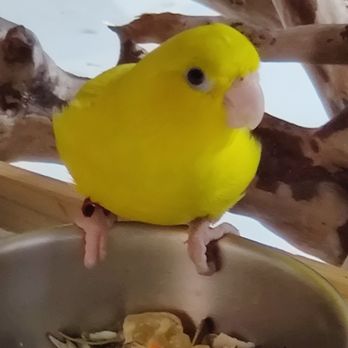
Where is `bowl`? bowl is located at coordinates (48, 265).